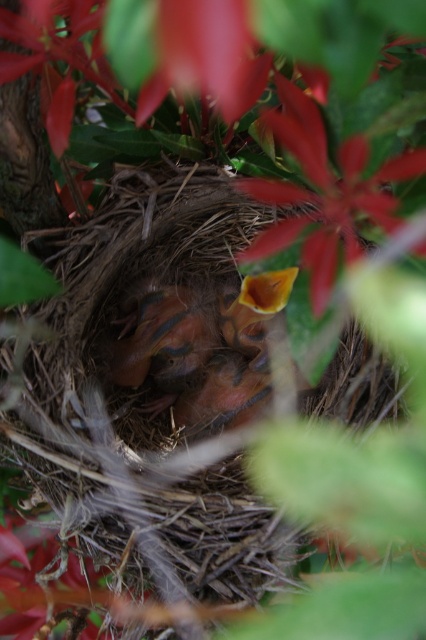
Question: Does orange smooth beak at center appear on the right side of smooth yellow petal at center?

Choices:
 (A) no
 (B) yes

Answer: (A)

Question: Does orange smooth beak at center have a smaller size compared to smooth yellow petal at center?

Choices:
 (A) yes
 (B) no

Answer: (A)

Question: Which of the following is the farthest from the observer?

Choices:
 (A) smooth yellow petal at center
 (B) orange smooth beak at center

Answer: (B)

Question: Which object is closer to the camera taking this photo?

Choices:
 (A) smooth yellow petal at center
 (B) orange smooth beak at center

Answer: (A)

Question: Is orange smooth beak at center below smooth yellow petal at center?

Choices:
 (A) no
 (B) yes

Answer: (B)